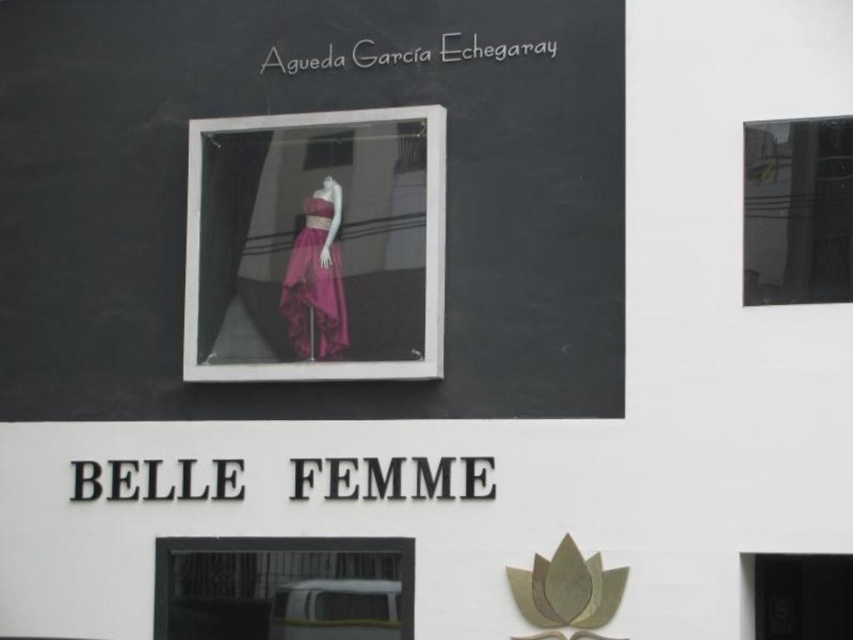
Who is positioned more to the left, white plastic van at lower center or purple satin dress at center?

white plastic van at lower center

Can you confirm if white plastic van at lower center is smaller than purple satin dress at center?

Actually, white plastic van at lower center might be larger than purple satin dress at center.

The image size is (853, 640). I want to click on white plastic van at lower center, so click(x=283, y=588).

Which is below, pink satin dress at center or white plastic van at lower center?

white plastic van at lower center is lower down.

From the picture: Does pink satin dress at center appear on the right side of white plastic van at lower center?

Correct, you'll find pink satin dress at center to the right of white plastic van at lower center.

Who is more forward, (401, 172) or (282, 637)?

Point (401, 172) is in front.

Locate an element on the screen. This screenshot has width=853, height=640. pink satin dress at center is located at coordinates (315, 246).

Is pink satin dress at center to the right of purple satin dress at center from the viewer's perspective?

Yes, pink satin dress at center is to the right of purple satin dress at center.

Find the location of a particular element. This screenshot has height=640, width=853. pink satin dress at center is located at coordinates (315, 246).

Where is `pink satin dress at center`? pink satin dress at center is located at coordinates (315, 246).